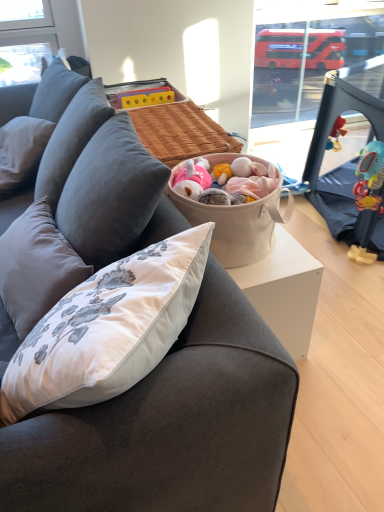
Question: Is gray fabric pillow at left directly adjacent to beige fabric basket at center?

Choices:
 (A) no
 (B) yes

Answer: (A)

Question: Is gray fabric pillow at left oriented towards beige fabric basket at center?

Choices:
 (A) yes
 (B) no

Answer: (B)

Question: Can you confirm if gray fabric pillow at left is thinner than beige fabric basket at center?

Choices:
 (A) yes
 (B) no

Answer: (A)

Question: From a real-world perspective, is gray fabric pillow at left physically above beige fabric basket at center?

Choices:
 (A) no
 (B) yes

Answer: (A)

Question: Can you confirm if gray fabric pillow at left is shorter than beige fabric basket at center?

Choices:
 (A) no
 (B) yes

Answer: (B)

Question: Considering the relative positions of beige fabric basket at center and transparent plastic window screen at upper right in the image provided, is beige fabric basket at center to the left or to the right of transparent plastic window screen at upper right?

Choices:
 (A) right
 (B) left

Answer: (B)

Question: From a real-world perspective, relative to transparent plastic window screen at upper right, is beige fabric basket at center vertically above or below?

Choices:
 (A) below
 (B) above

Answer: (B)

Question: Is beige fabric basket at center spatially inside transparent plastic window screen at upper right, or outside of it?

Choices:
 (A) inside
 (B) outside

Answer: (B)

Question: From their relative heights in the image, would you say beige fabric basket at center is taller or shorter than transparent plastic window screen at upper right?

Choices:
 (A) tall
 (B) short

Answer: (B)

Question: Based on their positions, is transparent plastic window screen at upper right located to the left or right of dark gray fabric couch at center?

Choices:
 (A) right
 (B) left

Answer: (A)

Question: Which is correct: transparent plastic window screen at upper right is inside dark gray fabric couch at center, or outside of it?

Choices:
 (A) inside
 (B) outside

Answer: (B)

Question: Based on their sizes in the image, would you say transparent plastic window screen at upper right is bigger or smaller than dark gray fabric couch at center?

Choices:
 (A) small
 (B) big

Answer: (A)

Question: From the image's perspective, is transparent plastic window screen at upper right above or below dark gray fabric couch at center?

Choices:
 (A) above
 (B) below

Answer: (A)

Question: From a real-world perspective, is gray fabric pillow at left positioned above or below transparent plastic window screen at upper right?

Choices:
 (A) below
 (B) above

Answer: (B)

Question: In the image, is gray fabric pillow at left on the left side or the right side of transparent plastic window screen at upper right?

Choices:
 (A) right
 (B) left

Answer: (B)